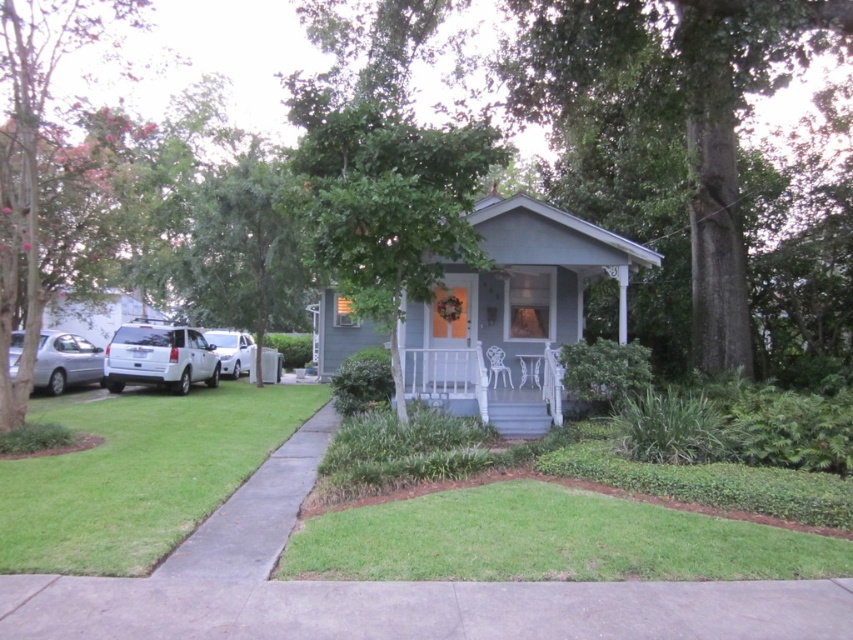
Between point (531, 401) and point (247, 339), which one is positioned behind?

The point (247, 339) is more distant.

What do you see at coordinates (486, 387) in the screenshot? The image size is (853, 640). I see `white painted wood porch at center` at bounding box center [486, 387].

Where is `white painted wood porch at center`? This screenshot has width=853, height=640. white painted wood porch at center is located at coordinates (486, 387).

Is point (79, 356) positioned in front of point (233, 355)?

Yes, point (79, 356) is in front of point (233, 355).

Can you confirm if satin silver sedan at left is positioned to the right of white matte car at left?

Incorrect, satin silver sedan at left is not on the right side of white matte car at left.

Is point (39, 340) in front of point (247, 342)?

Yes, it is.

Locate an element on the screen. satin silver sedan at left is located at coordinates (65, 362).

Between white matte suv at left and white matte car at left, which one appears on the left side from the viewer's perspective?

Positioned to the left is white matte car at left.

Is point (103, 376) more distant than point (219, 349)?

No, (103, 376) is in front of (219, 349).

Does point (164, 362) lie in front of point (228, 364)?

Yes, point (164, 362) is in front of point (228, 364).

The width and height of the screenshot is (853, 640). I want to click on white matte suv at left, so click(160, 356).